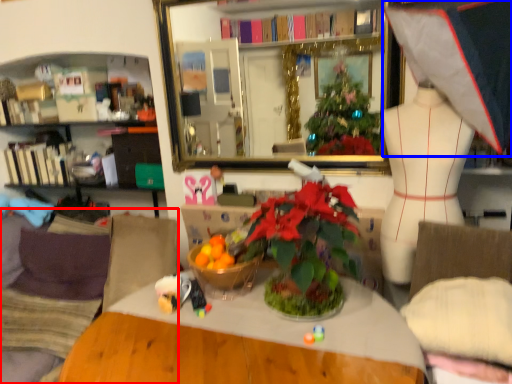
Question: Among these objects, which one is farthest to the camera, couch (highlighted by a red box) or clothing (highlighted by a blue box)?

Choices:
 (A) couch
 (B) clothing

Answer: (A)